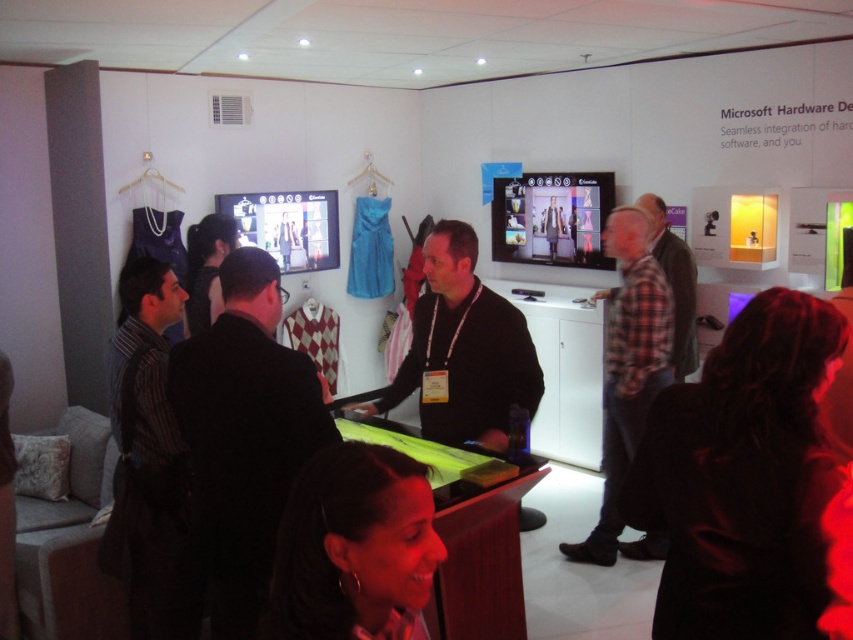
Who is more forward, (231,625) or (679,278)?

Point (231,625) is more forward.

Does black fabric jacket at center have a greater width compared to plaid fabric shirt at center?

Correct, the width of black fabric jacket at center exceeds that of plaid fabric shirt at center.

Between point (195, 378) and point (670, 248), which one is positioned in front?

Point (195, 378) is more forward.

What are the coordinates of `black fabric jacket at center` in the screenshot? It's located at (244, 435).

Which is behind, point (759, 492) or point (679, 323)?

Point (679, 323)

Does black fabric at center appear over plaid fabric shirt at center?

No.

What do you see at coordinates (743, 477) in the screenshot?
I see `black fabric at center` at bounding box center [743, 477].

Find the location of `black fabric at center`. black fabric at center is located at coordinates (743, 477).

Is the position of black fabric at center more distant than that of black matte jacket at center?

No, black fabric at center is closer to the viewer.

How far apart are black fabric at center and black matte jacket at center?

The distance of black fabric at center from black matte jacket at center is 1.24 meters.

Identify the location of black fabric at center. The image size is (853, 640). (743, 477).

The image size is (853, 640). I want to click on black fabric at center, so tap(743, 477).